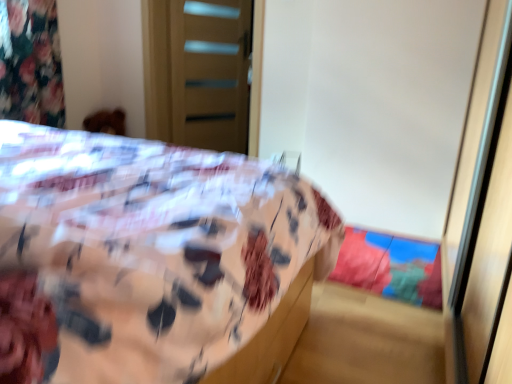
Question: Is floral fabric bed at center closer to the viewer compared to wooden door at upper center, the first screen door when ordered from left to right?

Choices:
 (A) yes
 (B) no

Answer: (A)

Question: Considering the relative sizes of floral fabric bed at center and wooden door at upper center, the first screen door when ordered from left to right, in the image provided, is floral fabric bed at center smaller than wooden door at upper center, the first screen door when ordered from left to right,?

Choices:
 (A) no
 (B) yes

Answer: (A)

Question: Is floral fabric bed at center thinner than wooden door at upper center, which ranks as the 2th screen door in right-to-left order?

Choices:
 (A) yes
 (B) no

Answer: (B)

Question: From the image's perspective, is floral fabric bed at center located beneath wooden door at upper center, the first screen door when ordered from left to right?

Choices:
 (A) no
 (B) yes

Answer: (B)

Question: Is floral fabric bed at center further to camera compared to wooden door at upper center, which ranks as the 2th screen door in right-to-left order?

Choices:
 (A) no
 (B) yes

Answer: (A)

Question: Considering their positions, is transparent plastic screen door at right, the 1th screen door viewed from the front, located in front of or behind floral fabric bed at center?

Choices:
 (A) front
 (B) behind

Answer: (B)

Question: From their relative heights in the image, would you say transparent plastic screen door at right, marked as the 1th screen door in a right-to-left arrangement, is taller or shorter than floral fabric bed at center?

Choices:
 (A) short
 (B) tall

Answer: (B)

Question: From the image's perspective, is transparent plastic screen door at right, placed as the second screen door when sorted from left to right, located above or below floral fabric bed at center?

Choices:
 (A) above
 (B) below

Answer: (A)

Question: Is transparent plastic screen door at right, placed as the second screen door when sorted from left to right, to the left or to the right of floral fabric bed at center in the image?

Choices:
 (A) left
 (B) right

Answer: (B)

Question: Does point (233, 140) appear closer or farther from the camera than point (103, 230)?

Choices:
 (A) farther
 (B) closer

Answer: (A)

Question: Based on their sizes in the image, would you say wooden door at upper center, which ranks as the 2th screen door in right-to-left order, is bigger or smaller than floral fabric bed at center?

Choices:
 (A) big
 (B) small

Answer: (B)

Question: From a real-world perspective, is wooden door at upper center, placed as the first screen door when sorted from back to front, positioned above or below floral fabric bed at center?

Choices:
 (A) below
 (B) above

Answer: (B)

Question: From the image's perspective, relative to floral fabric bed at center, is wooden door at upper center, which ranks as the 2th screen door in right-to-left order, above or below?

Choices:
 (A) below
 (B) above

Answer: (B)

Question: Visually, is floral fabric bed at center positioned to the left or to the right of transparent plastic screen door at right, arranged as the 2th screen door when viewed from the back?

Choices:
 (A) right
 (B) left

Answer: (B)

Question: Considering their positions, is floral fabric bed at center located in front of or behind transparent plastic screen door at right, arranged as the 2th screen door when viewed from the back?

Choices:
 (A) front
 (B) behind

Answer: (A)